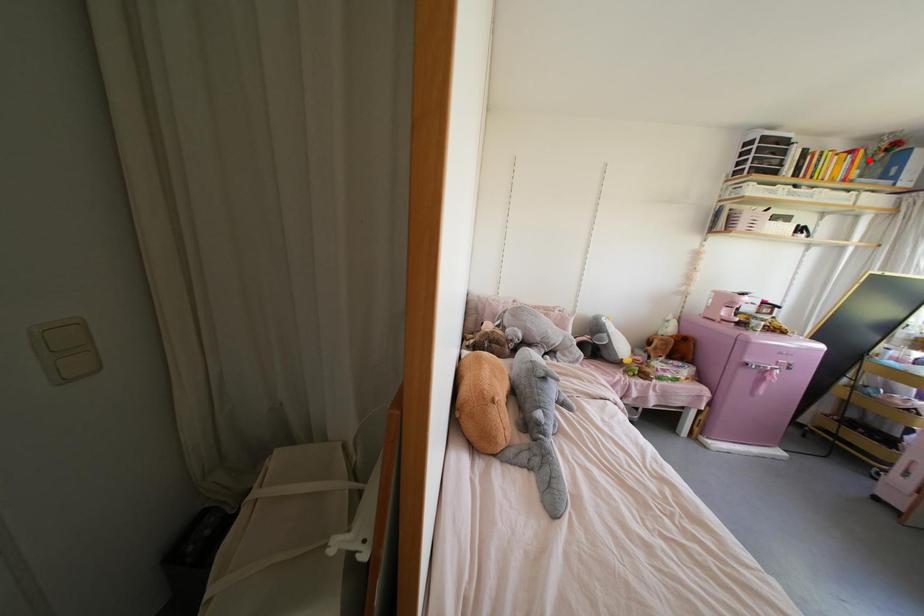
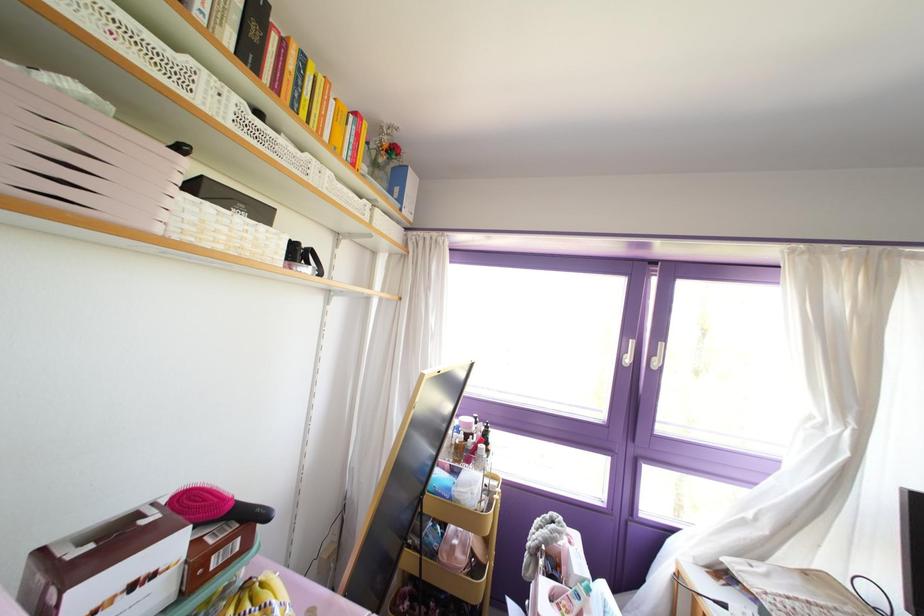
Question: I am providing you with two images of the same scene from different viewpoints. In image1, a red point is highlighted. Considering the same 3D point in image2, which of the following is correct?

Choices:
 (A) It is closer
 (B) It is farther

Answer: (A)